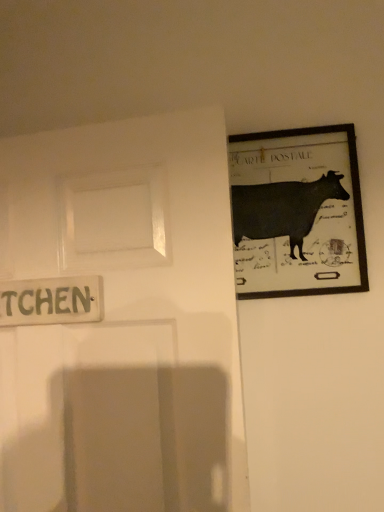
Describe the element at coordinates (297, 213) in the screenshot. I see `matte black picture frame at upper right` at that location.

Where is `matte black picture frame at upper right`? This screenshot has width=384, height=512. matte black picture frame at upper right is located at coordinates (297, 213).

Measure the distance between point (254, 205) and camera.

Point (254, 205) and camera are 1.04 meters apart.

Where is `matte black picture frame at upper right`? The image size is (384, 512). matte black picture frame at upper right is located at coordinates (297, 213).